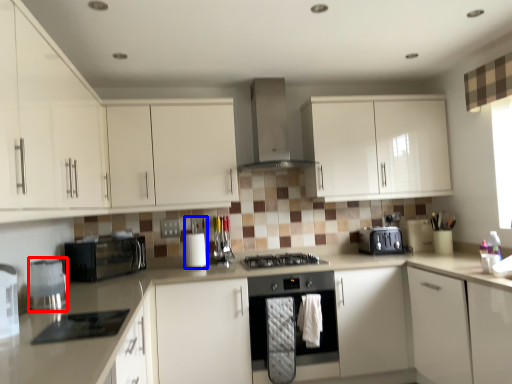
Question: Which object appears closest to the camera in this image, kitchen appliance (highlighted by a red box) or appliance (highlighted by a blue box)?

Choices:
 (A) kitchen appliance
 (B) appliance

Answer: (A)